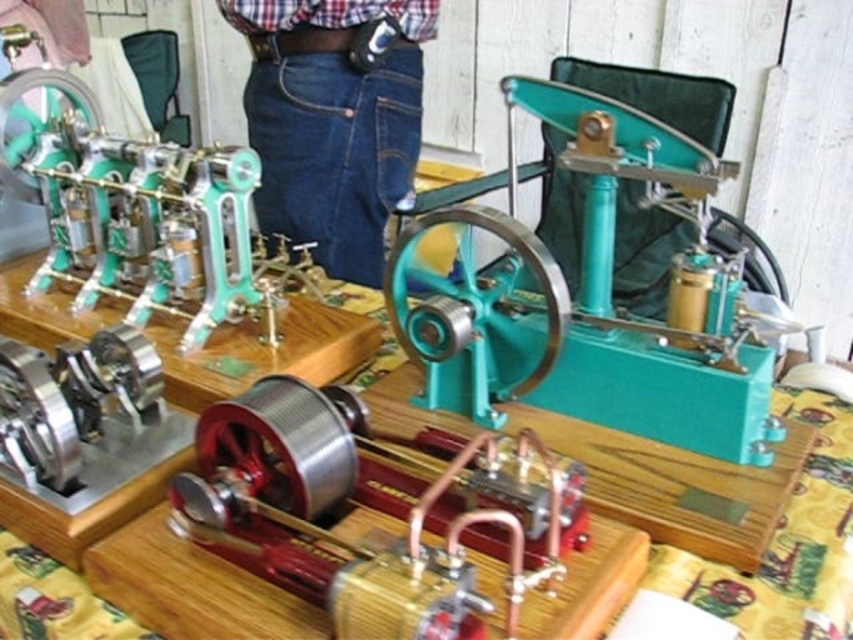
You are a security camera positioned at the top of the room. You need to determine if the denim jeans at center is located in the lower half of the image. Based on the coordinates provided, can you confirm this?

The denim jeans at center is located at coordinates point (334, 120). Since the y coordinate is 0.392, which is less than 0.5, the denim jeans at center is in the lower half of the image.

You are a fashion designer observing the miniature steam engines display and notice the denim jeans at center and the plaid cotton shirt at upper center. Which clothing item is positioned higher in the image?

The denim jeans at center is taller than plaid cotton shirt at upper center, so the denim jeans at center is positioned higher in the image.